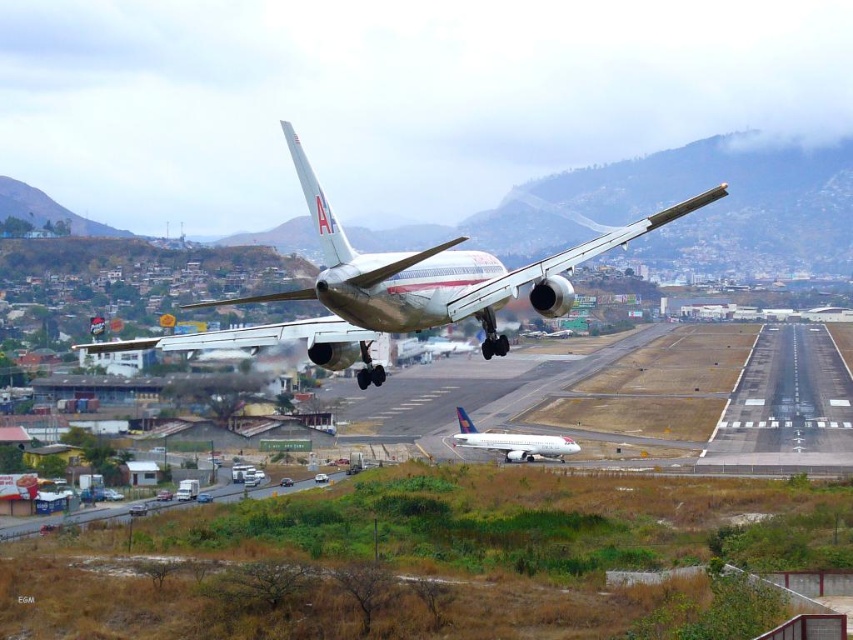
Question: Which object appears closest to the camera in this image?

Choices:
 (A) smooth asphalt runway at center
 (B) white glossy airplane at center
 (C) metallic silver airplane at center

Answer: (C)

Question: Can you confirm if metallic silver airplane at center is thinner than smooth asphalt runway at center?

Choices:
 (A) yes
 (B) no

Answer: (B)

Question: Does metallic silver airplane at center appear over smooth asphalt runway at center?

Choices:
 (A) no
 (B) yes

Answer: (B)

Question: Considering the real-world distances, which object is farthest from the white glossy airplane at center?

Choices:
 (A) metallic silver airplane at center
 (B) smooth asphalt runway at center

Answer: (A)

Question: Is smooth asphalt runway at center positioned before white glossy airplane at center?

Choices:
 (A) yes
 (B) no

Answer: (A)

Question: Which of these objects is positioned closest to the white glossy airplane at center?

Choices:
 (A) metallic silver airplane at center
 (B) smooth asphalt runway at center

Answer: (B)